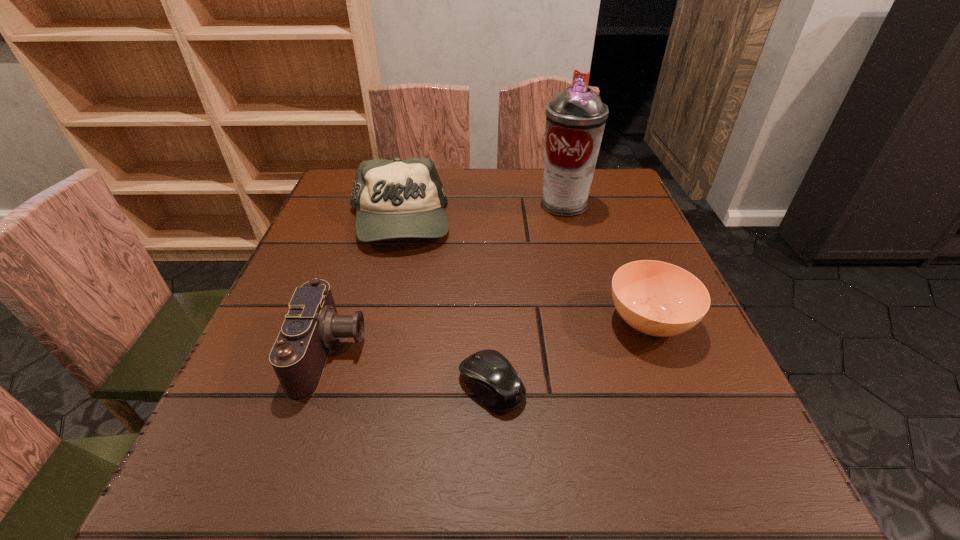
The width and height of the screenshot is (960, 540). I want to click on vacant space located on the right of the shortest object, so click(x=714, y=385).

Identify the location of aerosol can situated at the far edge. The width and height of the screenshot is (960, 540). (575, 119).

Find the location of `baseball cap at the far edge`. baseball cap at the far edge is located at coordinates (397, 198).

Find the location of a particular element. Image resolution: width=960 pixels, height=540 pixels. baseball cap that is at the left edge is located at coordinates tap(397, 198).

Identify the location of camera that is positioned at the left edge. (298, 357).

Where is `aerosol can located in the right edge section of the desktop`? aerosol can located in the right edge section of the desktop is located at coordinates (575, 119).

Where is `soup bowl positioned at the right edge`? The height and width of the screenshot is (540, 960). soup bowl positioned at the right edge is located at coordinates tap(656, 298).

Locate an element on the screen. This screenshot has height=540, width=960. object present at the far left corner is located at coordinates (397, 198).

Find the location of `object at the far right corner`. object at the far right corner is located at coordinates (575, 119).

Locate an element on the screen. The width and height of the screenshot is (960, 540). free point at the near edge is located at coordinates (523, 497).